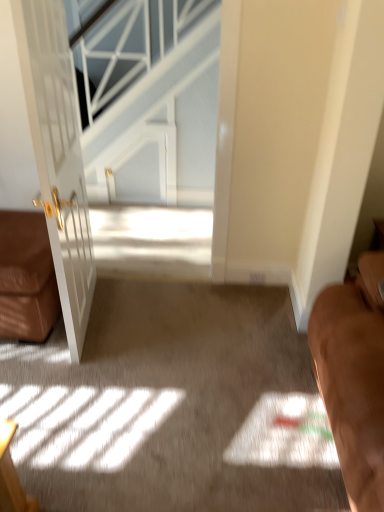
Question: Is white textured glass at upper center next to white glossy door at left?

Choices:
 (A) yes
 (B) no

Answer: (B)

Question: Can you confirm if white textured glass at upper center is positioned to the left of white glossy door at left?

Choices:
 (A) no
 (B) yes

Answer: (A)

Question: Can you confirm if white textured glass at upper center is thinner than white glossy door at left?

Choices:
 (A) no
 (B) yes

Answer: (A)

Question: Could you tell me if white textured glass at upper center is turned towards white glossy door at left?

Choices:
 (A) no
 (B) yes

Answer: (B)

Question: Are white textured glass at upper center and white glossy door at left far apart?

Choices:
 (A) yes
 (B) no

Answer: (A)

Question: Is white glossy door at left bigger or smaller than white textured glass at upper center?

Choices:
 (A) big
 (B) small

Answer: (B)

Question: From the image's perspective, is white glossy door at left above or below white textured glass at upper center?

Choices:
 (A) below
 (B) above

Answer: (A)

Question: Relative to white textured glass at upper center, is white glossy door at left in front or behind?

Choices:
 (A) behind
 (B) front

Answer: (B)

Question: Is white glossy door at left spatially inside white textured glass at upper center, or outside of it?

Choices:
 (A) inside
 (B) outside

Answer: (B)

Question: Looking at their shapes, would you say white glossy door at left is wider or thinner than brown leather couch at left?

Choices:
 (A) wide
 (B) thin

Answer: (B)

Question: Is white glossy door at left inside or outside of brown leather couch at left?

Choices:
 (A) outside
 (B) inside

Answer: (A)

Question: In terms of height, does white glossy door at left look taller or shorter compared to brown leather couch at left?

Choices:
 (A) short
 (B) tall

Answer: (B)

Question: Considering their positions, is white glossy door at left located in front of or behind brown leather couch at left?

Choices:
 (A) front
 (B) behind

Answer: (A)

Question: Do you think white textured glass at upper center is within white glossy door at left, or outside of it?

Choices:
 (A) inside
 (B) outside

Answer: (B)

Question: Is white textured glass at upper center in front of or behind white glossy door at left in the image?

Choices:
 (A) front
 (B) behind

Answer: (B)